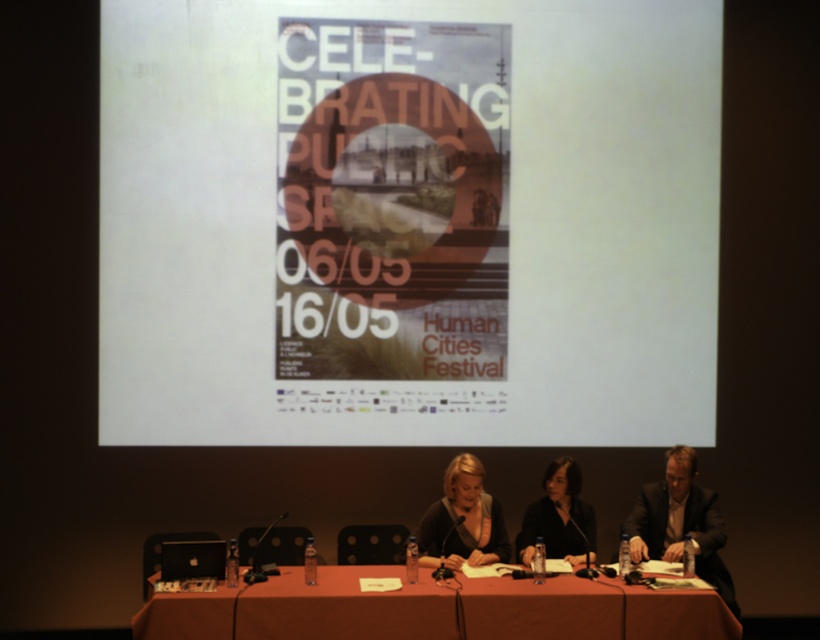
Question: Among these points, which one is farthest from the camera?

Choices:
 (A) (427, 253)
 (B) (494, 634)

Answer: (A)

Question: Is the position of dark suit at center more distant than that of black matte dress at center?

Choices:
 (A) no
 (B) yes

Answer: (B)

Question: Is white paper at center thinner than matte paper poster at center?

Choices:
 (A) no
 (B) yes

Answer: (A)

Question: Which object appears farthest from the camera in this image?

Choices:
 (A) dark gray suit at center
 (B) dark suit at center
 (C) smooth brown table at center

Answer: (A)

Question: Which object is the farthest from the matte paper poster at center?

Choices:
 (A) smooth brown table at center
 (B) white paper at center
 (C) dark suit at center

Answer: (A)

Question: Does white paper at center appear on the right side of dark gray suit at center?

Choices:
 (A) yes
 (B) no

Answer: (B)